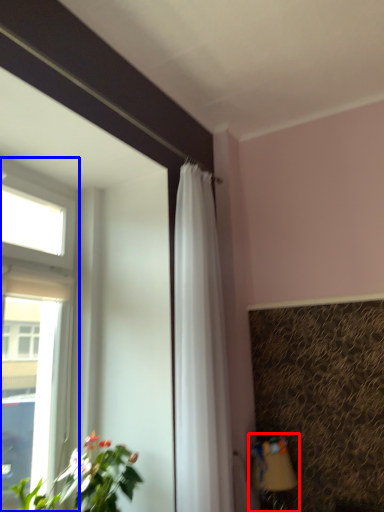
Question: Which object appears closest to the camera in this image, table lamp (highlighted by a red box) or window (highlighted by a blue box)?

Choices:
 (A) table lamp
 (B) window

Answer: (B)